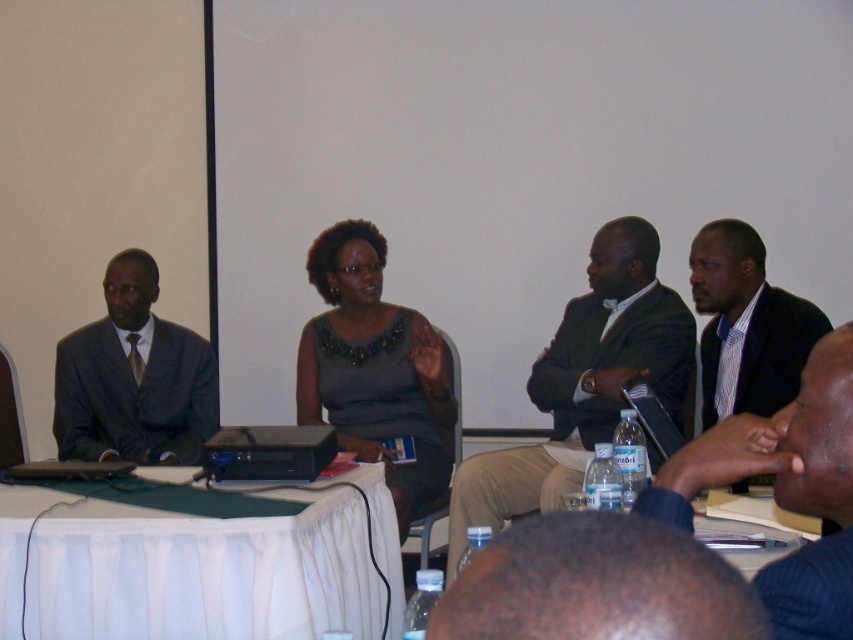
You are organizing a photo shoot and need to arrange two participants, the dark green suit at center and the striped cotton shirt at right, so that they are at the same height in the frame. Given their current heights, what adjustment would you make to achieve this?

The dark green suit at center is much taller than the striped cotton shirt at right. To make them appear the same height in the frame, you could lower the camera angle slightly for the dark green suit at center or raise the camera angle for the striped cotton shirt at right, or adjust their seating positions to compensate for the height difference.